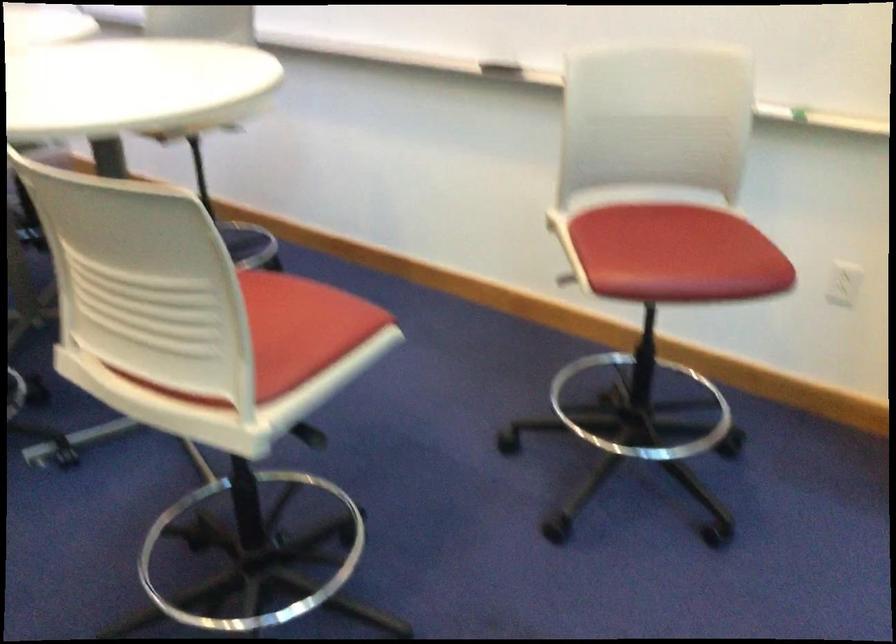
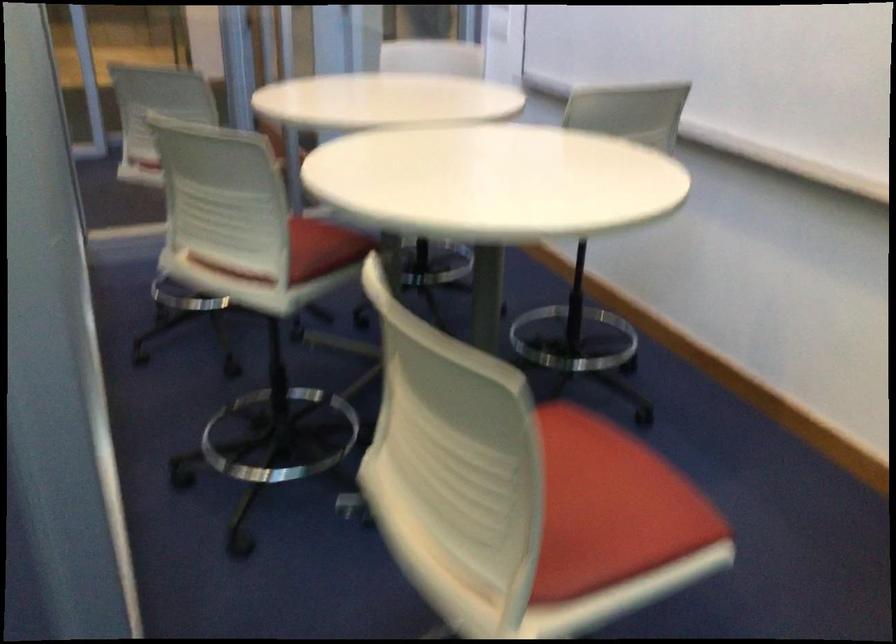
Question: What movement of the cameraman would produce the second image?

Choices:
 (A) Left
 (B) Right
 (C) Forward
 (D) Backward

Answer: (C)